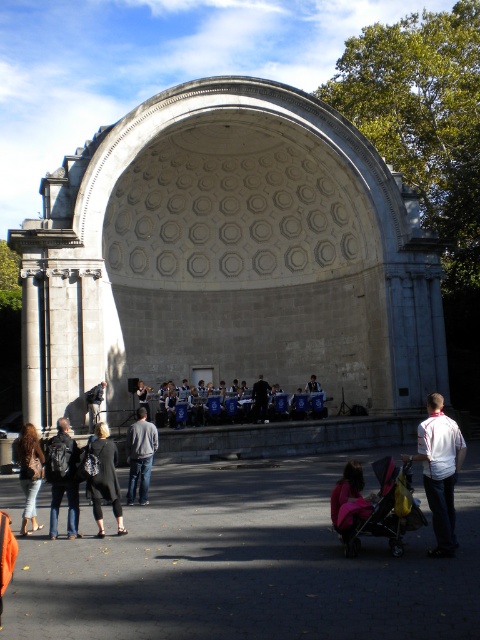
You are organizing a small event in the area in front of the stone structure. You need to place both the yellow fabric baby carriage at lower center and the gray cotton jacket at center. Since space is limited, which object should you prioritize placing first to ensure both can fit?

The yellow fabric baby carriage at lower center occupies less space than the gray cotton jacket at center, so you should place the gray cotton jacket at center first to ensure both can fit.

You are standing in the outdoor scene and want to walk towards the gray stone amphitheater at center and the gray cotton jacket at center. Which object will you reach first?

You will reach the gray stone amphitheater at center first because it is closer to you than the gray cotton jacket at center, which is further away.

You are standing at the point marked by coordinates (376, 508) in the image. What object is located exactly at that point?

The yellow fabric baby carriage at lower center is located exactly at point (376, 508).